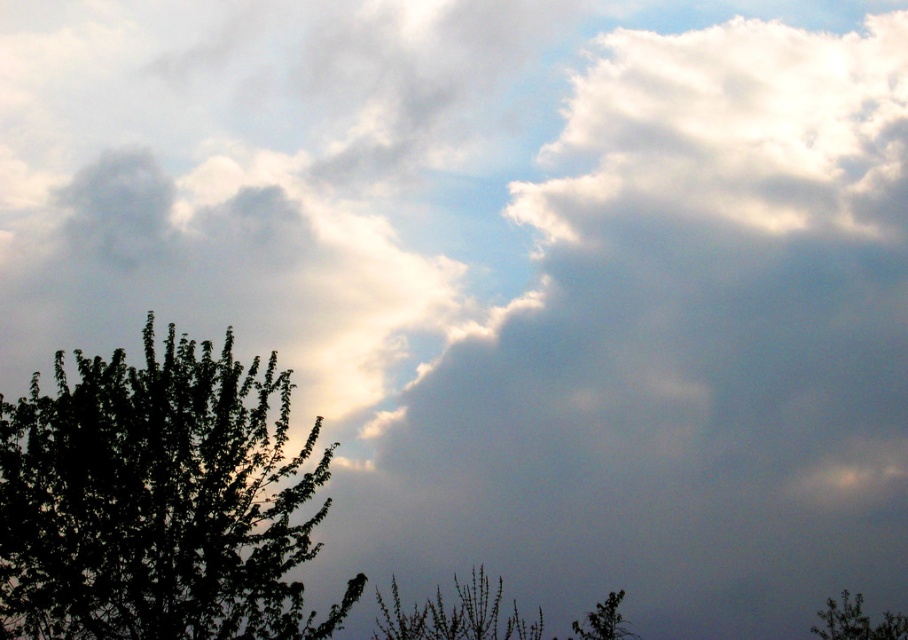
The height and width of the screenshot is (640, 908). Describe the element at coordinates (455, 614) in the screenshot. I see `green matte tree at lower center` at that location.

Is point (393, 634) more distant than point (591, 611)?

No, (393, 634) is closer to viewer.

Identify the location of green matte tree at lower center. (455, 614).

Who is lower down, dark green leafy tree at lower left or green matte tree at lower right?

green matte tree at lower right is below.

Does dark green leafy tree at lower left have a larger size compared to green matte tree at lower right?

Yes.

Between point (283, 394) and point (609, 596), which one is positioned behind?

The point (283, 394) is more distant.

Image resolution: width=908 pixels, height=640 pixels. In order to click on dark green leafy tree at lower left in this screenshot , I will do `click(156, 502)`.

Can you confirm if green leafy tree at lower right is positioned to the right of green matte tree at lower right?

Yes, green leafy tree at lower right is to the right of green matte tree at lower right.

Is green leafy tree at lower right bigger than green matte tree at lower right?

Indeed, green leafy tree at lower right has a larger size compared to green matte tree at lower right.

Is point (822, 611) positioned before point (597, 605)?

That is False.

Where is `green leafy tree at lower right`? The image size is (908, 640). green leafy tree at lower right is located at coordinates (856, 620).